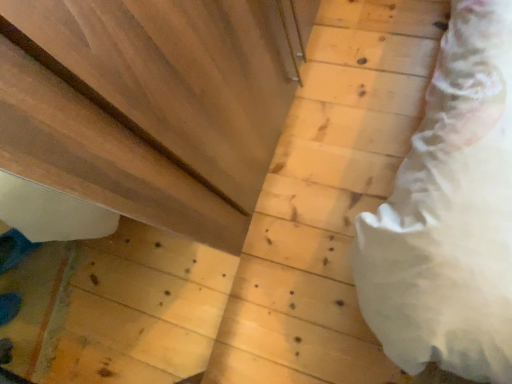
Image resolution: width=512 pixels, height=384 pixels. Find the location of `free location above light wood stairwell at center (from a real-world perspective)`. free location above light wood stairwell at center (from a real-world perspective) is located at coordinates (325, 179).